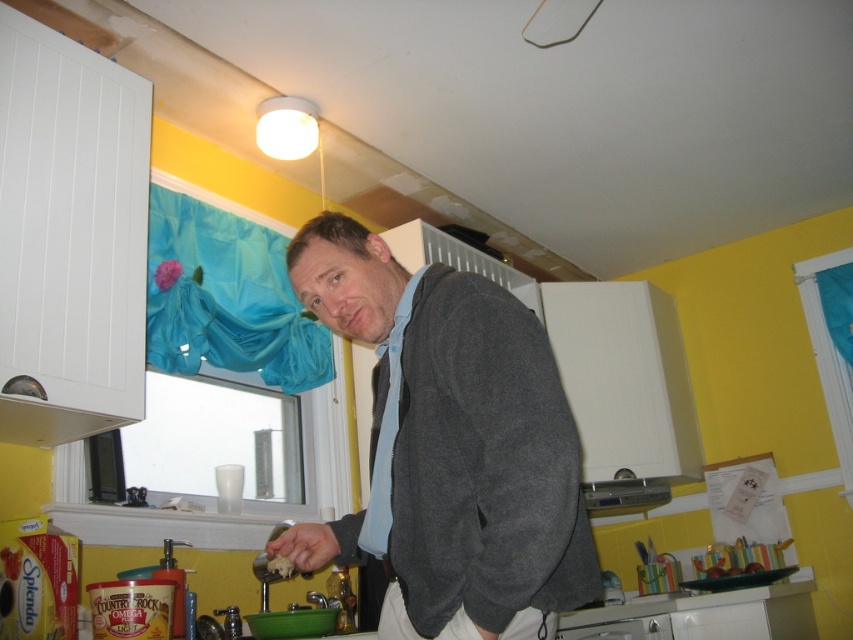
Question: Does gray wool sweater at center appear on the left side of white crumbly food at lower center?

Choices:
 (A) yes
 (B) no

Answer: (B)

Question: From the image, what is the correct spatial relationship of gray wool sweater at center in relation to white crumbly food at lower center?

Choices:
 (A) right
 (B) left

Answer: (A)

Question: Is gray wool sweater at center positioned at the back of white crumbly food at lower center?

Choices:
 (A) yes
 (B) no

Answer: (B)

Question: Which of the following is the farthest from the observer?

Choices:
 (A) white crumbly food at lower center
 (B) gray wool sweater at center

Answer: (A)

Question: Which point is farther to the camera?

Choices:
 (A) (509, 582)
 (B) (271, 568)

Answer: (B)